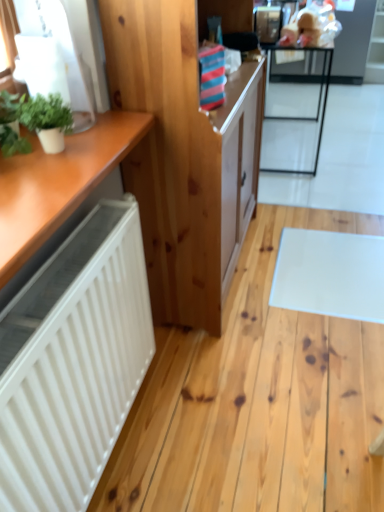
Question: Considering the relative positions of metallic black table at upper right and natural wood cabinet at center in the image provided, is metallic black table at upper right to the left of natural wood cabinet at center from the viewer's perspective?

Choices:
 (A) yes
 (B) no

Answer: (B)

Question: Is metallic black table at upper right outside natural wood cabinet at center?

Choices:
 (A) no
 (B) yes

Answer: (B)

Question: Is natural wood cabinet at center located within metallic black table at upper right?

Choices:
 (A) no
 (B) yes

Answer: (A)

Question: From a real-world perspective, does metallic black table at upper right sit lower than natural wood cabinet at center?

Choices:
 (A) yes
 (B) no

Answer: (A)

Question: Is metallic black table at upper right bigger than natural wood cabinet at center?

Choices:
 (A) yes
 (B) no

Answer: (B)

Question: Is point (51, 143) closer or farther from the camera than point (289, 110)?

Choices:
 (A) farther
 (B) closer

Answer: (B)

Question: In terms of size, does green matte plant at upper left, positioned as the 2th houseplant in left-to-right order, appear bigger or smaller than metallic black table at upper right?

Choices:
 (A) big
 (B) small

Answer: (B)

Question: Would you say green matte plant at upper left, positioned as the 2th houseplant in left-to-right order, is inside or outside metallic black table at upper right?

Choices:
 (A) outside
 (B) inside

Answer: (A)

Question: In the image, is green matte plant at upper left, which is the first houseplant in right-to-left order, on the left side or the right side of metallic black table at upper right?

Choices:
 (A) left
 (B) right

Answer: (A)

Question: Would you say natural wood cabinet at center is inside or outside metallic black table at upper right?

Choices:
 (A) outside
 (B) inside

Answer: (A)

Question: Relative to metallic black table at upper right, is natural wood cabinet at center in front or behind?

Choices:
 (A) behind
 (B) front

Answer: (B)

Question: Is point (114, 15) closer or farther from the camera than point (297, 155)?

Choices:
 (A) farther
 (B) closer

Answer: (B)

Question: From the image's perspective, is natural wood cabinet at center located above or below metallic black table at upper right?

Choices:
 (A) above
 (B) below

Answer: (B)

Question: Considering the positions of green matte plant at upper left, which is the first houseplant in right-to-left order, and green leafy plant at left, positioned as the 1th houseplant in left-to-right order, in the image, is green matte plant at upper left, which is the first houseplant in right-to-left order, wider or thinner than green leafy plant at left, positioned as the 1th houseplant in left-to-right order,?

Choices:
 (A) thin
 (B) wide

Answer: (B)

Question: From a real-world perspective, relative to green leafy plant at left, positioned as the 1th houseplant in left-to-right order, is green matte plant at upper left, which is the first houseplant in right-to-left order, vertically above or below?

Choices:
 (A) above
 (B) below

Answer: (A)